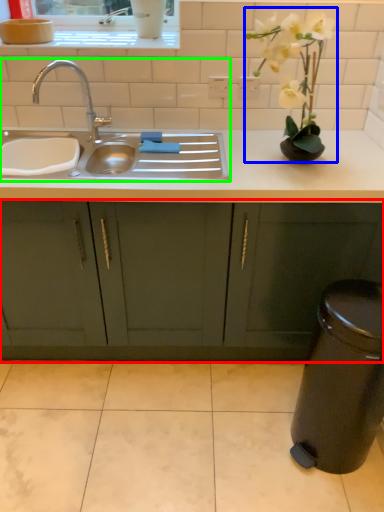
Question: Estimate the real-world distances between objects in this image. Which object is farther from cabinetry (highlighted by a red box), floral arrangement (highlighted by a blue box) or sink (highlighted by a green box)?

Choices:
 (A) floral arrangement
 (B) sink

Answer: (A)